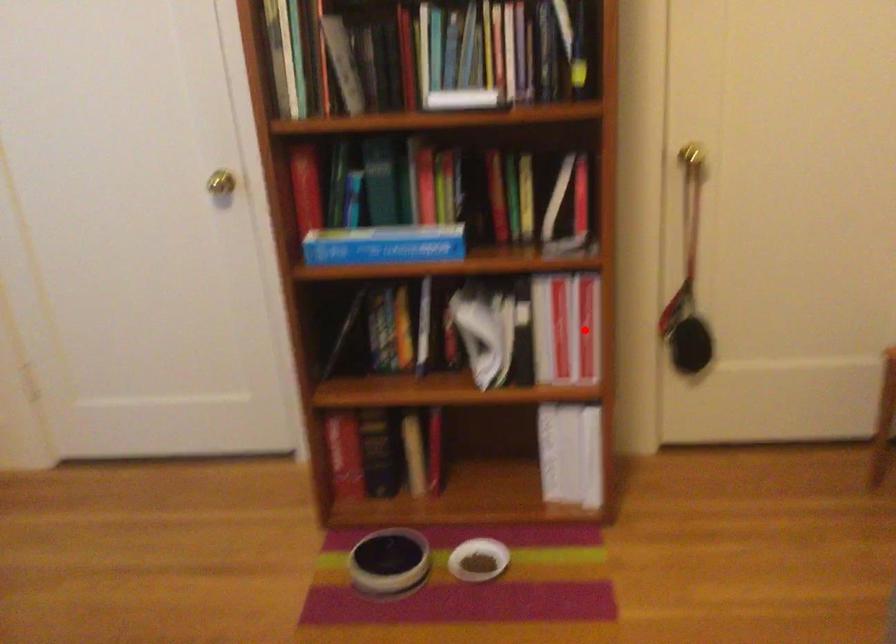
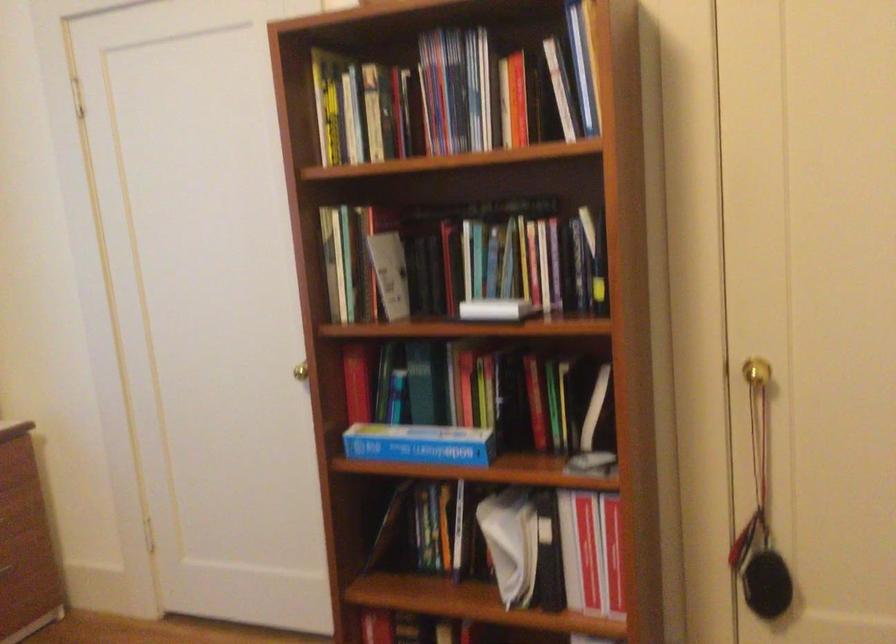
Locate, in the second image, the point that corresponds to the highlighted location in the first image.

(613, 554)